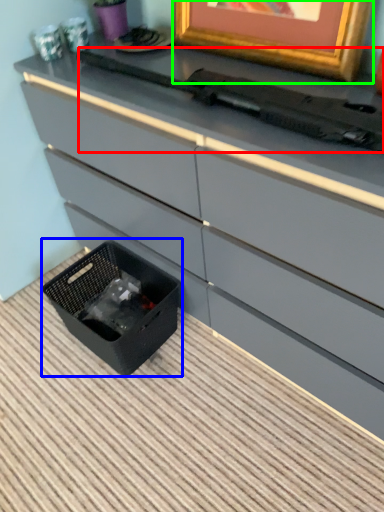
Question: Which is nearer to the typewriter (highlighted by a red box)? storage box (highlighted by a blue box) or picture frame (highlighted by a green box).

Choices:
 (A) storage box
 (B) picture frame

Answer: (B)